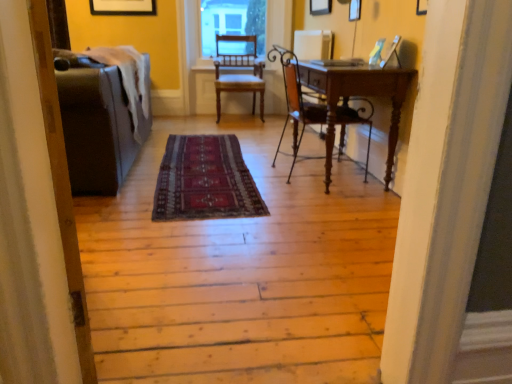
The height and width of the screenshot is (384, 512). Identify the location of matte black couch at left. (61, 183).

Find the location of `clear glass window screen at upper center`. clear glass window screen at upper center is located at coordinates (232, 22).

What is the approximate height of dark red woven rug at center?

It is 1.95 inches.

The height and width of the screenshot is (384, 512). I want to click on wooden chair at center, the first chair positioned from the top, so click(239, 74).

What is the approximate height of wooden chair at center, which is the first chair from back to front?

wooden chair at center, which is the first chair from back to front, is 38.12 inches in height.

You are a GUI agent. You are given a task and a screenshot of the screen. Output one action in this format:
    pyautogui.click(x=<x>, y=<y>)
    Task: Click on the wooden chair at center, the second chair positioned from the left
    
    Given the screenshot: What is the action you would take?
    pyautogui.click(x=295, y=100)

Measure the distance from matte gray couch at left to dark red woven rug at center.

21.97 inches.

Does point (108, 88) appear closer or farther from the camera than point (230, 162)?

Clearly, point (108, 88) is closer to the camera than point (230, 162).

From the picture: Which of these two, matte gray couch at left or dark red woven rug at center, is thinner?

matte gray couch at left.

Where is `couch behind the dark red woven rug at center`? The width and height of the screenshot is (512, 384). couch behind the dark red woven rug at center is located at coordinates (94, 124).

Identify the location of mat below the matte black couch at left (from a real-world perspective). The height and width of the screenshot is (384, 512). (205, 180).

Considering the relative sizes of dark red woven rug at center and matte black couch at left in the image provided, is dark red woven rug at center smaller than matte black couch at left?

Yes.

Are dark red woven rug at center and matte black couch at left located far from each other?

Yes.

Is dark red woven rug at center looking in the opposite direction of matte black couch at left?

dark red woven rug at center is not turned away from matte black couch at left.

Where is `couch above the wooden chair at center, which is the second chair from top to bottom (from the image's perspective)`? This screenshot has width=512, height=384. couch above the wooden chair at center, which is the second chair from top to bottom (from the image's perspective) is located at coordinates (94, 124).

Is matte gray couch at left not near wooden chair at center, the 1th chair in the bottom-to-top sequence?

That's right, there is a large distance between matte gray couch at left and wooden chair at center, the 1th chair in the bottom-to-top sequence.

Considering the points (145, 125) and (371, 127), which point is in front, point (145, 125) or point (371, 127)?

The point (371, 127) is more forward.

Based on their sizes in the image, would you say matte gray couch at left is bigger or smaller than wooden chair at center, the 1th chair in the bottom-to-top sequence?

In the image, matte gray couch at left appears to be larger than wooden chair at center, the 1th chair in the bottom-to-top sequence.

How different are the orientations of matte black couch at left and dark red woven rug at center in degrees?

The facing directions of matte black couch at left and dark red woven rug at center are 109 degrees apart.

Based on the photo, can you confirm if matte black couch at left is positioned to the right of dark red woven rug at center?

Incorrect, matte black couch at left is not on the right side of dark red woven rug at center.

From a real-world perspective, between matte black couch at left and dark red woven rug at center, who is vertically lower?

From a 3D spatial view, dark red woven rug at center is below.

The height and width of the screenshot is (384, 512). I want to click on screen door above the dark red woven rug at center (from a real-world perspective), so click(x=61, y=183).

Between matte black couch at left and matte gray couch at left, which one has smaller size?

Smaller between the two is matte black couch at left.

Can you tell me how much matte black couch at left and matte gray couch at left differ in facing direction?

The facing directions of matte black couch at left and matte gray couch at left are 160 degrees apart.

From the picture: Is there a large distance between matte black couch at left and matte gray couch at left?

That's right, there is a large distance between matte black couch at left and matte gray couch at left.

Which is nearer, (36,62) or (121,157)?

The point (36,62) is in front.

Is wooden chair at center, the first chair from the left, to the left or to the right of matte gray couch at left in the image?

wooden chair at center, the first chair from the left, is to the right of matte gray couch at left.

Is wooden chair at center, which is the first chair from back to front, beside matte gray couch at left?

There is a gap between wooden chair at center, which is the first chair from back to front, and matte gray couch at left.

Considering the points (232, 62) and (137, 151), which point is behind, point (232, 62) or point (137, 151)?

The point (232, 62) is farther from the camera.

In order to click on chair that appears above the matte gray couch at left (from the image's perspective) in this screenshot , I will do `click(239, 74)`.

Is wooden chair at center, which is the second chair from top to bottom, looking in the opposite direction of matte gray couch at left?

Yes, wooden chair at center, which is the second chair from top to bottom, is facing away from matte gray couch at left.

From a real-world perspective, who is located higher, wooden chair at center, which is counted as the first chair, starting from the front, or matte gray couch at left?

wooden chair at center, which is counted as the first chair, starting from the front, is physically above.

Are wooden chair at center, the second chair positioned from the left, and matte gray couch at left far apart?

wooden chair at center, the second chair positioned from the left, is far away from matte gray couch at left.

Does wooden chair at center, which is counted as the 2th chair, starting from the back, have a smaller size compared to matte gray couch at left?

Indeed, wooden chair at center, which is counted as the 2th chair, starting from the back, has a smaller size compared to matte gray couch at left.

This screenshot has height=384, width=512. Find the location of `couch that appears above the dark red woven rug at center (from the image's perspective)`. couch that appears above the dark red woven rug at center (from the image's perspective) is located at coordinates (94, 124).

Locate an element on the screen. This screenshot has width=512, height=384. screen door below the dark red woven rug at center (from the image's perspective) is located at coordinates (61, 183).

In the scene shown: Based on their spatial positions, is matte gray couch at left or dark red woven rug at center further from wooden chair at center, which ranks as the second chair in right-to-left order?

Based on the image, matte gray couch at left appears to be further to wooden chair at center, which ranks as the second chair in right-to-left order.

Looking at the image, which one is located further to wooden chair at center, which ranks as the 1th chair in right-to-left order, wooden chair at center, the first chair from the left, or clear glass window screen at upper center?

Among the two, clear glass window screen at upper center is located further to wooden chair at center, which ranks as the 1th chair in right-to-left order.

From the image, which object appears to be nearer to clear glass window screen at upper center, matte black couch at left or dark red woven rug at center?

dark red woven rug at center lies closer to clear glass window screen at upper center than the other object.

From the image, which object appears to be farther from wooden chair at center, which ranks as the 1th chair in right-to-left order, matte gray couch at left or matte black couch at left?

matte black couch at left lies further to wooden chair at center, which ranks as the 1th chair in right-to-left order, than the other object.

Considering their positions, is dark red woven rug at center positioned further to matte black couch at left than clear glass window screen at upper center?

clear glass window screen at upper center lies further to matte black couch at left than the other object.

Based on their spatial positions, is matte black couch at left or wooden chair at center, which is counted as the 2th chair, starting from the back, further from wooden chair at center, which is the first chair from back to front?

matte black couch at left is positioned further to the anchor wooden chair at center, which is the first chair from back to front.

In the scene shown: Considering their positions, is clear glass window screen at upper center positioned closer to dark red woven rug at center than wooden chair at center, which ranks as the second chair in right-to-left order?

wooden chair at center, which ranks as the second chair in right-to-left order, is positioned closer to the anchor dark red woven rug at center.

Looking at this image, which object lies nearer to the anchor point dark red woven rug at center, matte gray couch at left or matte black couch at left?

The object closer to dark red woven rug at center is matte gray couch at left.

This screenshot has width=512, height=384. In order to click on couch positioned between matte black couch at left and clear glass window screen at upper center from near to far in this screenshot , I will do `click(94, 124)`.

Where is `mat located between matte gray couch at left and wooden chair at center, which ranks as the 1th chair in right-to-left order, in the left-right direction`? The image size is (512, 384). mat located between matte gray couch at left and wooden chair at center, which ranks as the 1th chair in right-to-left order, in the left-right direction is located at coordinates (205, 180).

Identify the location of couch positioned between dark red woven rug at center and wooden chair at center, arranged as the second chair when viewed from the front, from near to far. This screenshot has height=384, width=512. (94, 124).

At what (x,y) coordinates should I click in order to perform the action: click on chair between dark red woven rug at center and wooden chair at center, the first chair from the left, along the z-axis. Please return your answer as a coordinate pair (x, y). Looking at the image, I should click on (295, 100).